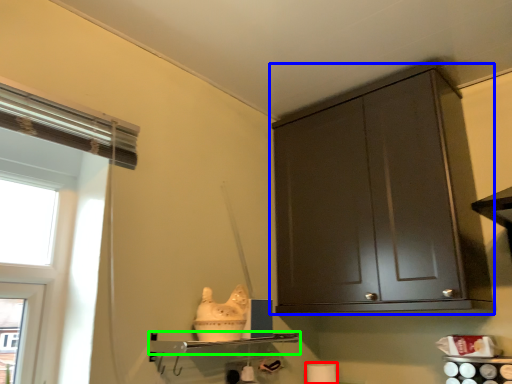
Question: Which object is positioned farthest from toilet paper (highlighted by a red box)? Select from cabinetry (highlighted by a blue box) and shelf (highlighted by a green box).

Choices:
 (A) cabinetry
 (B) shelf

Answer: (A)